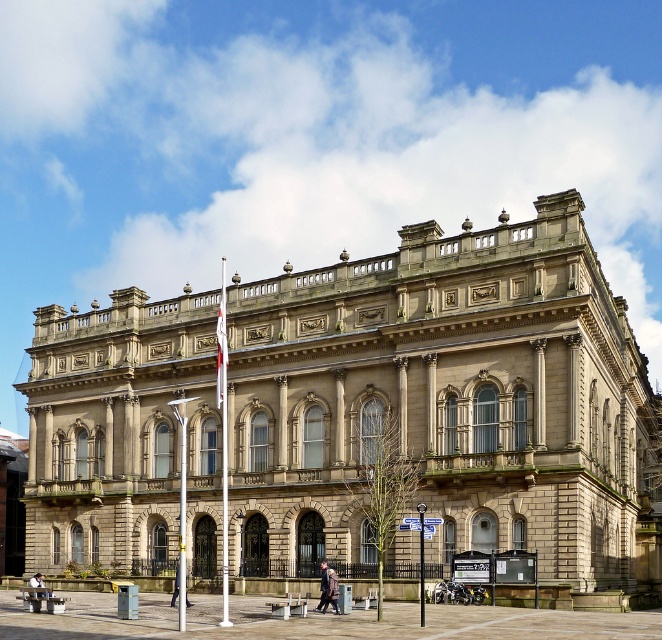
You are standing in the plaza in front of the beige stone building at center. You see a brown leather coat at center. Can you see the coat from your current position?

The brown leather coat at center is behind the beige stone building at center, so you cannot see it from your current position in the plaza.

In the scene shown: You are standing in the plaza in front of the beige stone building at center. You want to take a photo of the building with your smartphone. The recommended distance for optimal photo quality is between 150 to 200 feet. Is your current distance within the recommended range?

The beige stone building at center and viewer are 180.32 feet apart from each other. Since 180.32 feet falls within the recommended 150 to 200 feet range, your current distance is optimal for taking a photo.